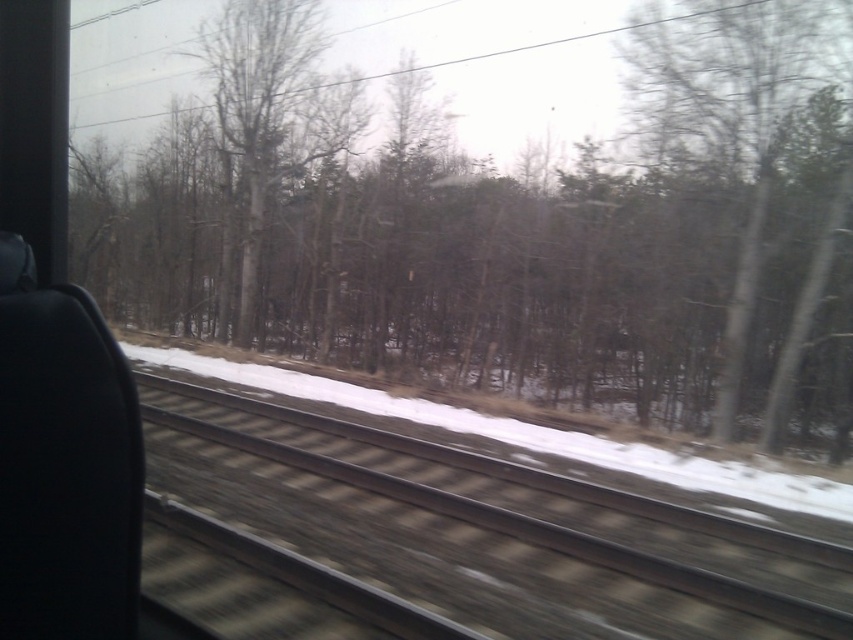
You are sitting in a train seat and looking out the window. There is a point marked at coordinates (508, 236) in the center of the window. What is located at that point?

The point at (508, 236) marks brown dry wood at center.